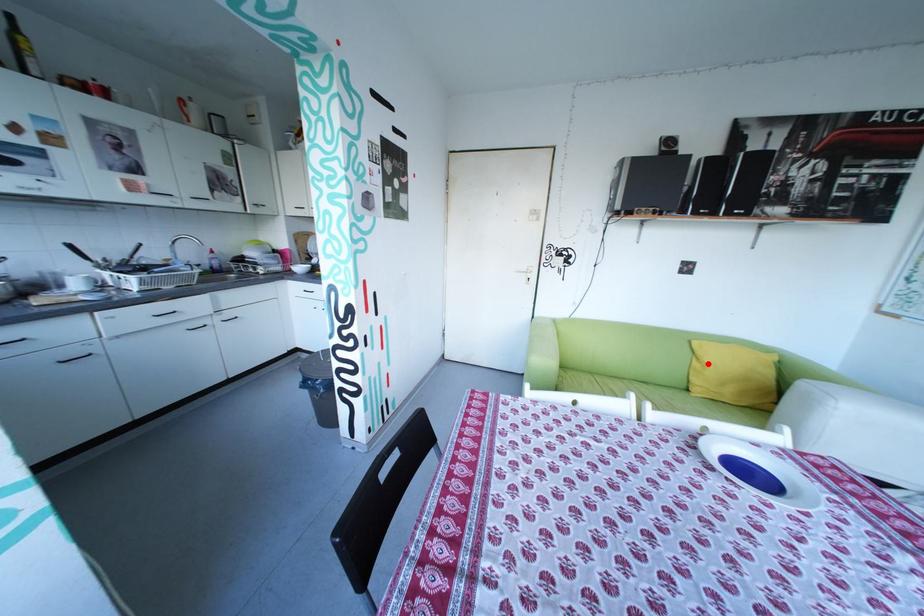
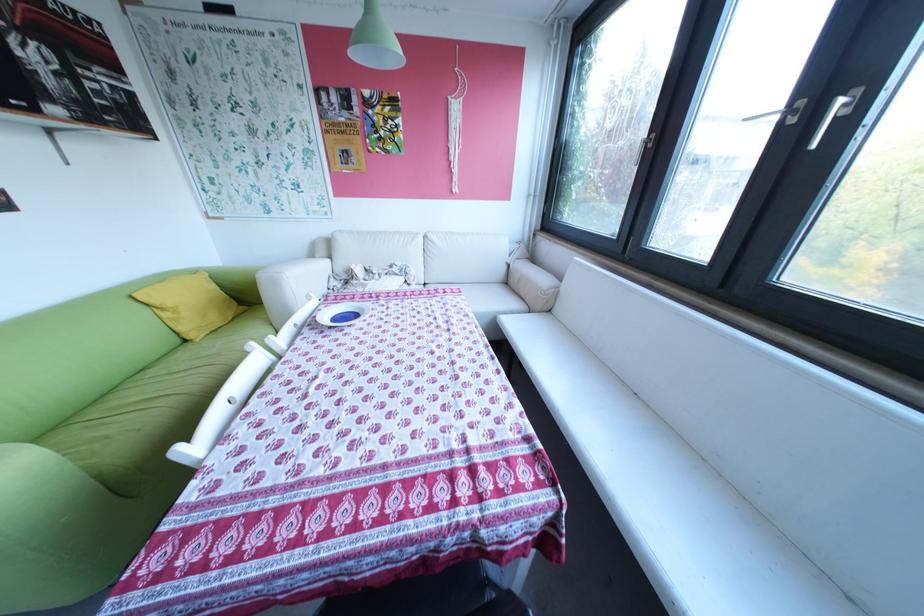
Locate, in the second image, the point that corresponds to the highlighted location in the first image.

(177, 314)